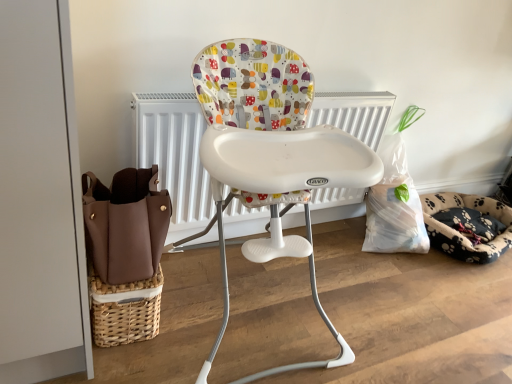
Question: From the image's perspective, is fluffy paw-patterned dog bed at right below white plastic highchair at center?

Choices:
 (A) yes
 (B) no

Answer: (A)

Question: Is fluffy paw-patterned dog bed at right completely or partially outside of white plastic highchair at center?

Choices:
 (A) no
 (B) yes

Answer: (B)

Question: Is fluffy paw-patterned dog bed at right positioned behind white plastic highchair at center?

Choices:
 (A) yes
 (B) no

Answer: (A)

Question: Can you confirm if fluffy paw-patterned dog bed at right is thinner than white plastic highchair at center?

Choices:
 (A) no
 (B) yes

Answer: (B)

Question: Does fluffy paw-patterned dog bed at right have a greater height compared to white plastic highchair at center?

Choices:
 (A) yes
 (B) no

Answer: (B)

Question: Can you confirm if fluffy paw-patterned dog bed at right is wider than white plastic highchair at center?

Choices:
 (A) no
 (B) yes

Answer: (A)

Question: Does white plastic highchair at center have a lesser height compared to fluffy paw-patterned dog bed at right?

Choices:
 (A) no
 (B) yes

Answer: (A)

Question: From the image's perspective, would you say white plastic highchair at center is shown under fluffy paw-patterned dog bed at right?

Choices:
 (A) yes
 (B) no

Answer: (B)

Question: Is white plastic highchair at center positioned beyond the bounds of fluffy paw-patterned dog bed at right?

Choices:
 (A) yes
 (B) no

Answer: (A)

Question: Does white plastic highchair at center have a smaller size compared to fluffy paw-patterned dog bed at right?

Choices:
 (A) no
 (B) yes

Answer: (A)

Question: From a real-world perspective, is white plastic highchair at center under fluffy paw-patterned dog bed at right?

Choices:
 (A) yes
 (B) no

Answer: (B)

Question: Does white plastic highchair at center have a lesser width compared to fluffy paw-patterned dog bed at right?

Choices:
 (A) yes
 (B) no

Answer: (B)

Question: Choose the correct answer: Is white plastic highchair at center inside fluffy paw-patterned dog bed at right or outside it?

Choices:
 (A) outside
 (B) inside

Answer: (A)